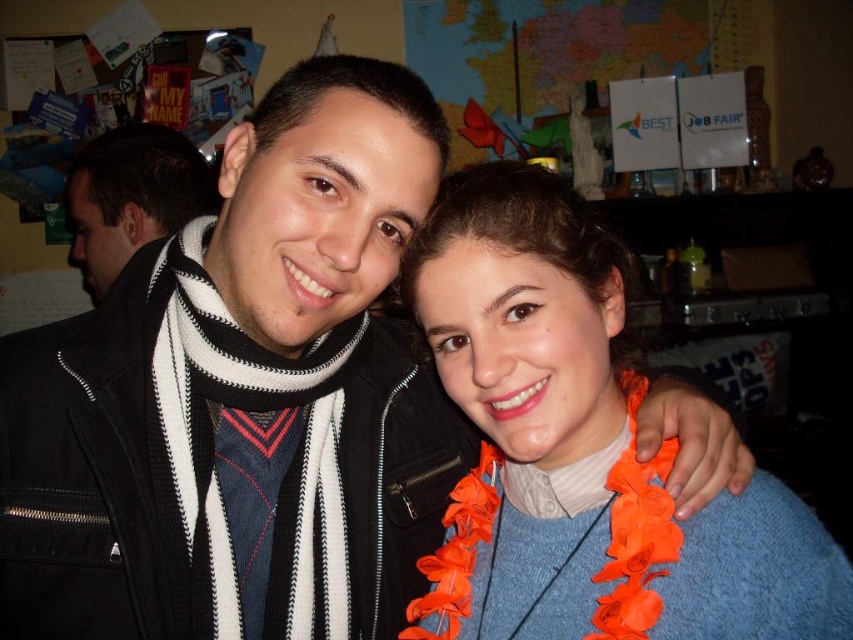
Question: Is orange fabric lei at center positioned behind black and white scarf at left?

Choices:
 (A) no
 (B) yes

Answer: (A)

Question: Among these points, which one is farthest from the camera?

Choices:
 (A) (717, 560)
 (B) (126, 179)

Answer: (B)

Question: Which object is closer to the camera taking this photo?

Choices:
 (A) black and white scarf at left
 (B) orange fabric lei at center

Answer: (B)

Question: Does orange fabric lei at center have a larger size compared to black and white scarf at left?

Choices:
 (A) no
 (B) yes

Answer: (A)

Question: Can you confirm if orange fabric lei at center is positioned below black and white scarf at left?

Choices:
 (A) yes
 (B) no

Answer: (A)